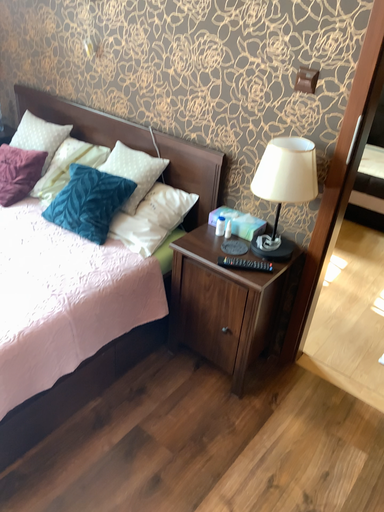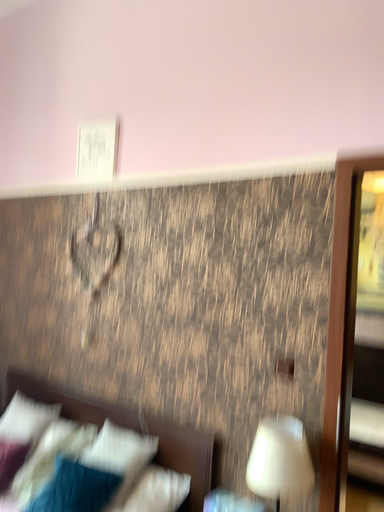
Question: Which way did the camera rotate in the video?

Choices:
 (A) rotated upward
 (B) rotated downward

Answer: (A)